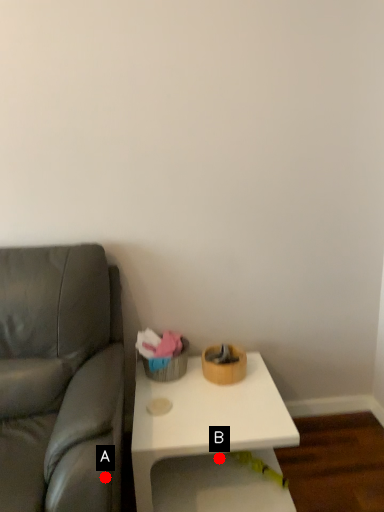
Question: Two points are circled on the image, labeled by A and B beside each circle. Which point is further to the camera?

Choices:
 (A) A is further
 (B) B is further

Answer: (B)